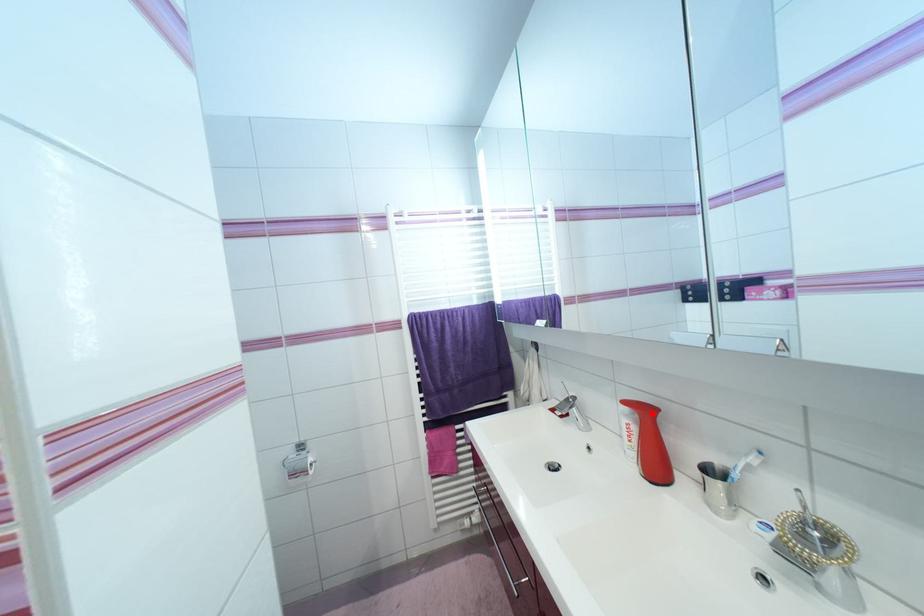
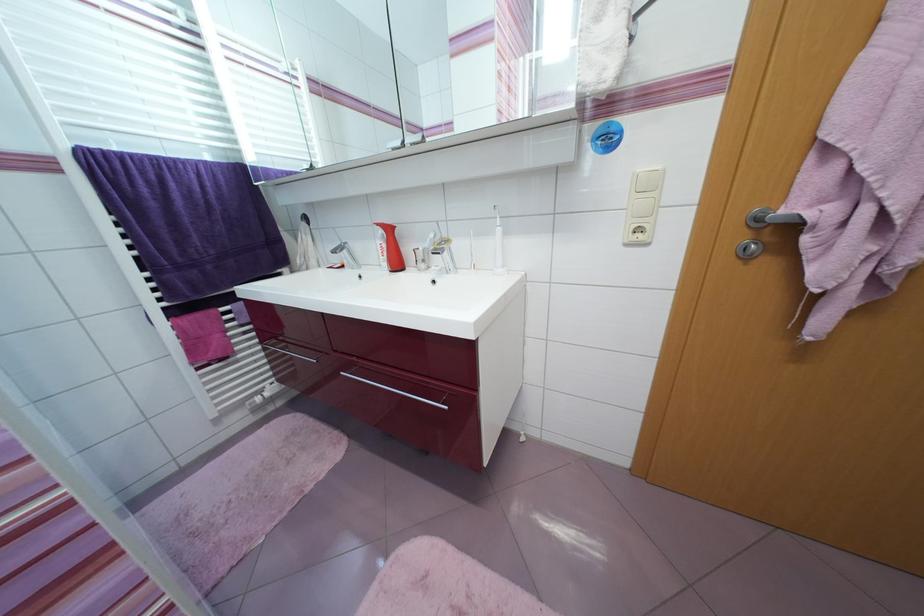
Question: I am providing you with two images of the same scene from different viewpoints. In image1, a red point is highlighted. Considering the same 3D point in image2, which of the following is correct?

Choices:
 (A) It is closer
 (B) It is farther

Answer: (A)